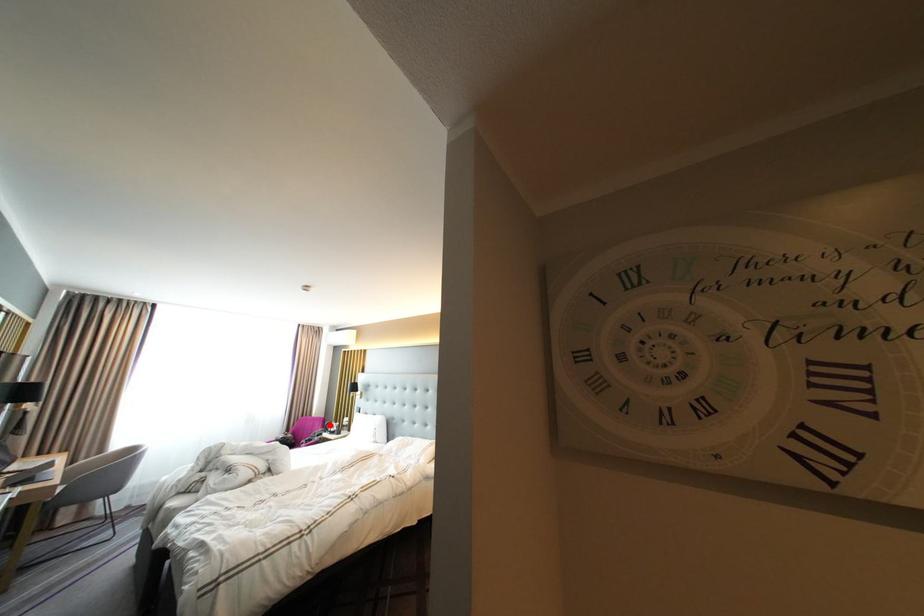
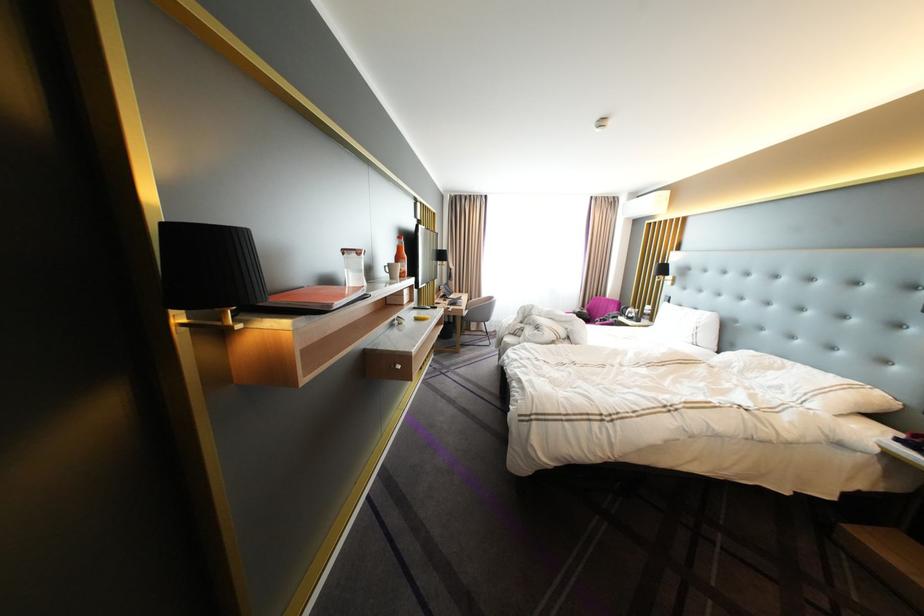
Where in the second image is the point corresponding to the highlighted location from the first image?

(625, 307)